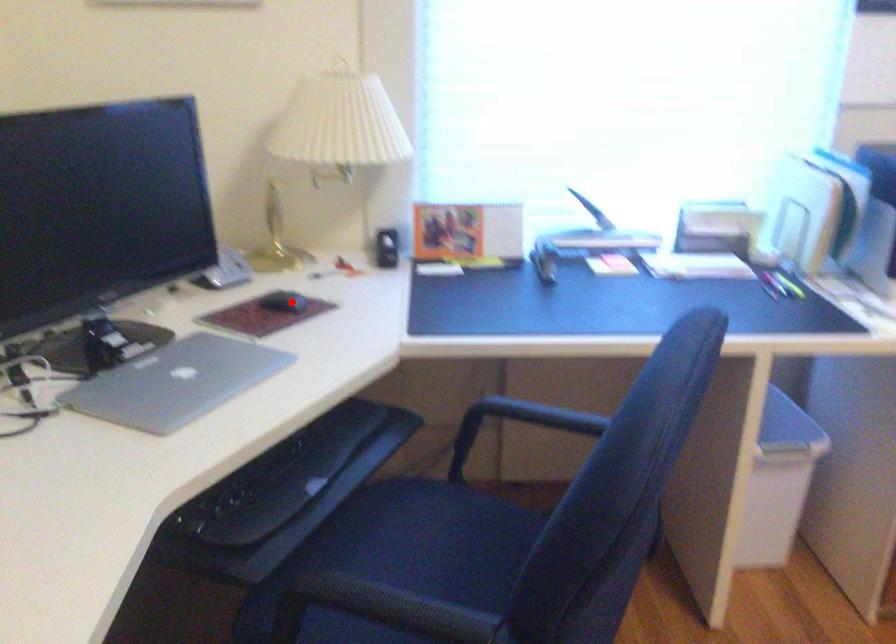
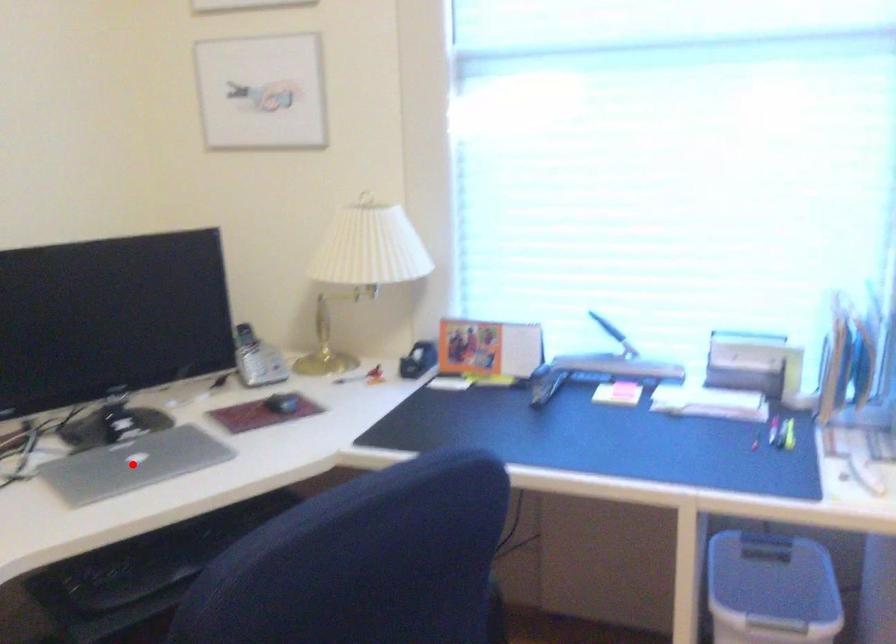
I am providing you with two images of the same scene from different viewpoints. A red point is marked on the first image and another point is marked on the second image. Is the red point in image1 aligned with the point shown in image2?

No